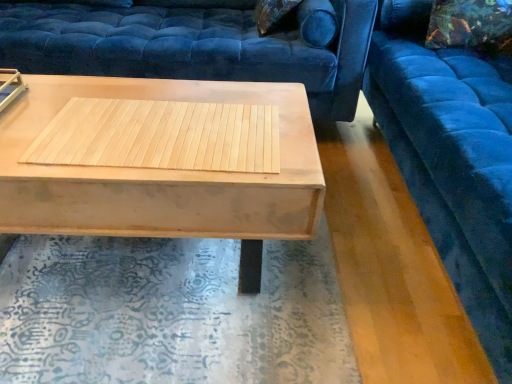
Question: From a real-world perspective, is velvet floral pillow at upper right over velvet blue studio couch at upper right, which is the first studio couch from right to left?

Choices:
 (A) no
 (B) yes

Answer: (B)

Question: Does velvet floral pillow at upper right have a greater width compared to velvet blue studio couch at upper right, which is the first studio couch from right to left?

Choices:
 (A) yes
 (B) no

Answer: (B)

Question: Is velvet floral pillow at upper right positioned with its back to velvet blue studio couch at upper right, which is the first studio couch from right to left?

Choices:
 (A) no
 (B) yes

Answer: (B)

Question: Is velvet floral pillow at upper right positioned beyond the bounds of velvet blue studio couch at upper right, the 2th studio couch in the left-to-right sequence?

Choices:
 (A) yes
 (B) no

Answer: (B)

Question: Is velvet floral pillow at upper right directly adjacent to velvet blue studio couch at upper right, which is the first studio couch from right to left?

Choices:
 (A) yes
 (B) no

Answer: (B)

Question: Can you confirm if velvet floral pillow at upper right is bigger than velvet blue studio couch at upper right, the 2th studio couch in the left-to-right sequence?

Choices:
 (A) yes
 (B) no

Answer: (B)

Question: Does velvet blue studio couch at upper right, which is the first studio couch from right to left, have a larger size compared to natural wood mat at center?

Choices:
 (A) no
 (B) yes

Answer: (B)

Question: Is velvet blue studio couch at upper right, which is the first studio couch from right to left, aimed at natural wood mat at center?

Choices:
 (A) yes
 (B) no

Answer: (A)

Question: Can you confirm if velvet blue studio couch at upper right, which is the first studio couch from right to left, is thinner than natural wood mat at center?

Choices:
 (A) no
 (B) yes

Answer: (A)

Question: Considering the relative sizes of velvet blue studio couch at upper right, the 2th studio couch in the left-to-right sequence, and natural wood mat at center in the image provided, is velvet blue studio couch at upper right, the 2th studio couch in the left-to-right sequence, smaller than natural wood mat at center?

Choices:
 (A) yes
 (B) no

Answer: (B)

Question: Does velvet blue studio couch at upper right, the 2th studio couch in the left-to-right sequence, appear on the left side of natural wood mat at center?

Choices:
 (A) yes
 (B) no

Answer: (B)

Question: From a real-world perspective, is velvet blue studio couch at upper right, which is the first studio couch from right to left, beneath natural wood mat at center?

Choices:
 (A) yes
 (B) no

Answer: (A)

Question: From the image's perspective, would you say natural wood mat at center is positioned over velvet blue studio couch at upper right, which is the first studio couch from right to left?

Choices:
 (A) no
 (B) yes

Answer: (A)